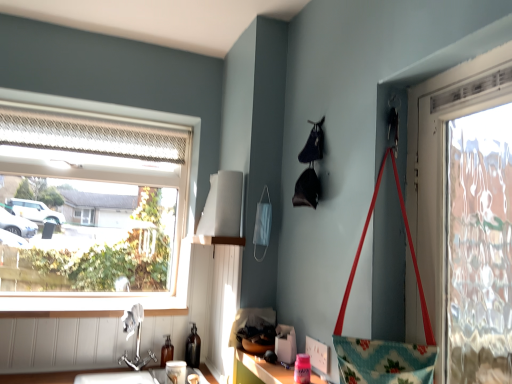
Question: Is point (182, 360) positioned closer to the camera than point (168, 352)?

Choices:
 (A) closer
 (B) farther

Answer: (B)

Question: Based on their sizes in the image, would you say matte white cup at lower center is bigger or smaller than translucent glass bottle at lower center, the 1th bottle in the left-to-right sequence?

Choices:
 (A) small
 (B) big

Answer: (B)

Question: Which object is the farthest from the floral fabric handbag at right?

Choices:
 (A) white fabric lampshade at upper center
 (B) translucent glass bottle at lower center, the 1th bottle in the left-to-right sequence
 (C) clear glass window at upper left
 (D) silver metallic faucet at lower left
 (E) pink plastic container at lower center

Answer: (C)

Question: Estimate the real-world distances between objects in this image. Which object is farther from the matte glass bottle at lower left, which is counted as the second bottle, starting from the left?

Choices:
 (A) translucent glass bottle at lower center, the 1th bottle in the left-to-right sequence
 (B) clear glass window at upper left
 (C) silver metallic faucet at lower left
 (D) white plastic power outlet at lower center
 (E) white fabric lampshade at upper center

Answer: (D)